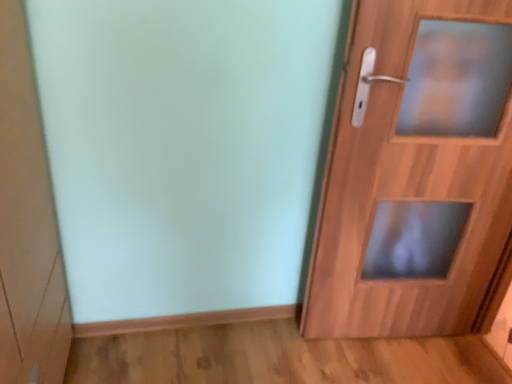
Image resolution: width=512 pixels, height=384 pixels. Identify the location of free spot to the right of wooden door at right. (442, 354).